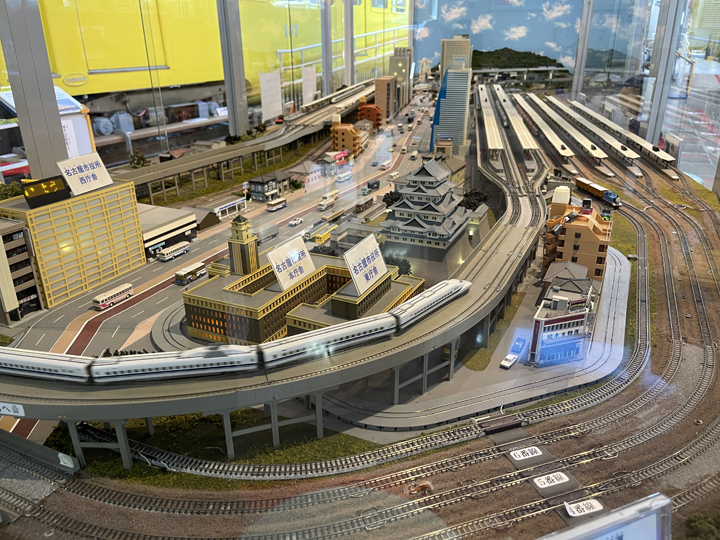
The height and width of the screenshot is (540, 720). What are the coordinates of `window` in the screenshot? It's located at (684, 102).